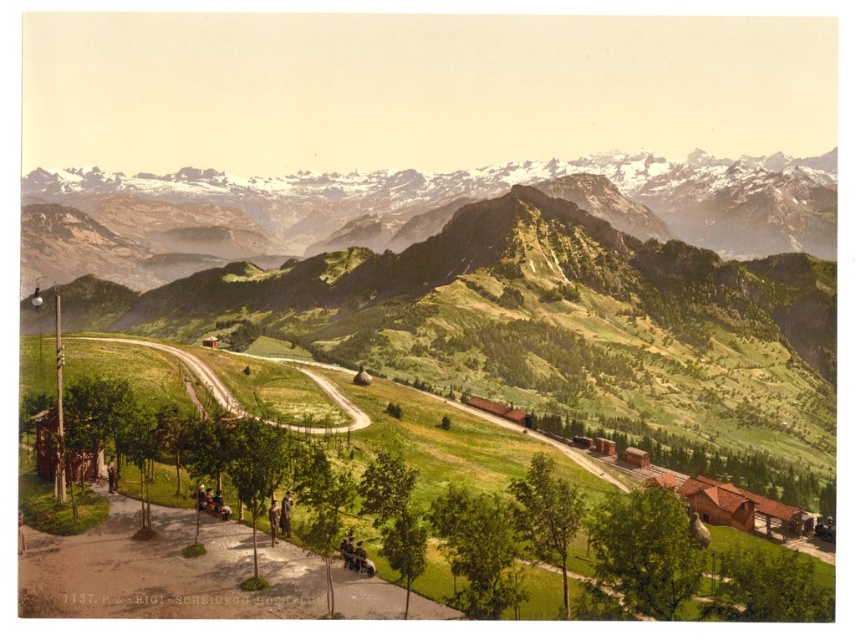
Question: Does green grassy mountain at upper center lie behind brown wooden houses at lower right?

Choices:
 (A) no
 (B) yes

Answer: (B)

Question: Which point is farther from the camera taking this photo?

Choices:
 (A) (732, 518)
 (B) (424, 234)

Answer: (B)

Question: Which object is closer to the camera taking this photo?

Choices:
 (A) green grassy mountain at upper center
 (B) brown wooden houses at lower right

Answer: (B)

Question: Can you confirm if green grassy mountain at upper center is positioned to the left of brown wooden houses at lower right?

Choices:
 (A) yes
 (B) no

Answer: (A)

Question: Which point is farther from the camera taking this photo?

Choices:
 (A) (676, 486)
 (B) (697, 225)
 (C) (141, 216)

Answer: (C)

Question: Does green grassy hillside at center lie in front of brown wooden houses at lower right?

Choices:
 (A) no
 (B) yes

Answer: (A)